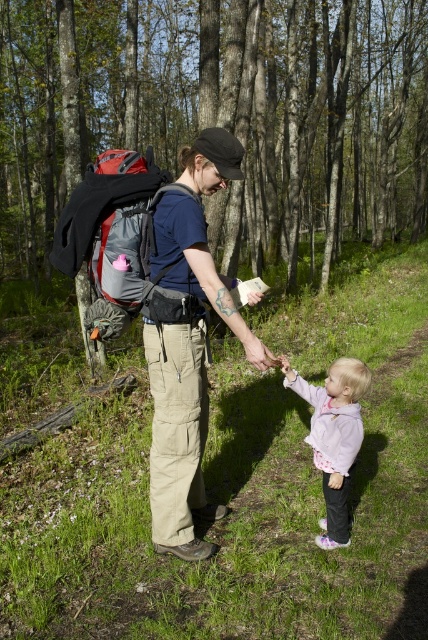
Question: Among these points, which one is nearest to the camera?

Choices:
 (A) (169, 410)
 (B) (130, 234)
 (C) (338, 461)

Answer: (A)

Question: Is matte blue shirt at center bigger than matte gray backpack at center?

Choices:
 (A) no
 (B) yes

Answer: (B)

Question: Can you confirm if green leafy trees at center is wider than matte gray backpack at center?

Choices:
 (A) yes
 (B) no

Answer: (A)

Question: Does matte blue shirt at center come in front of matte gray backpack at center?

Choices:
 (A) no
 (B) yes

Answer: (B)

Question: Estimate the real-world distances between objects in this image. Which object is closer to the green leafy trees at center?

Choices:
 (A) matte gray backpack at center
 (B) matte blue shirt at center

Answer: (B)

Question: Which point is closer to the camera taking this photo?

Choices:
 (A) (344, 404)
 (B) (152, 168)

Answer: (A)